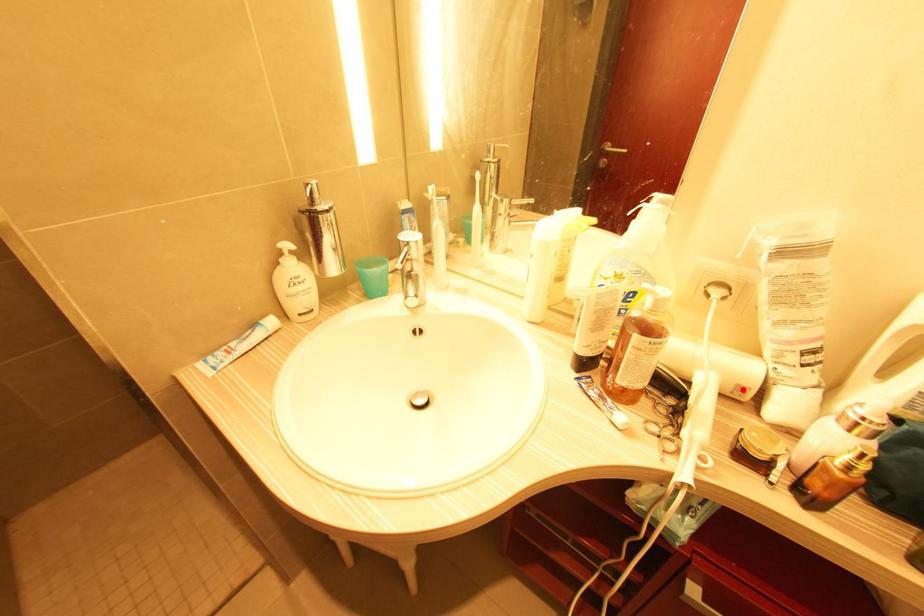
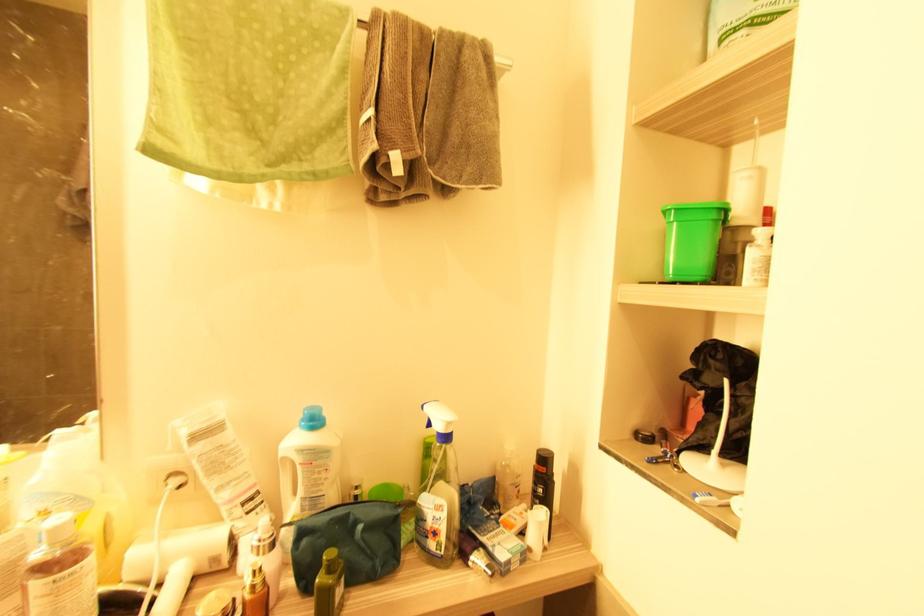
In the second image, find the point that corresponds to the highlighted location in the first image.

(216, 561)